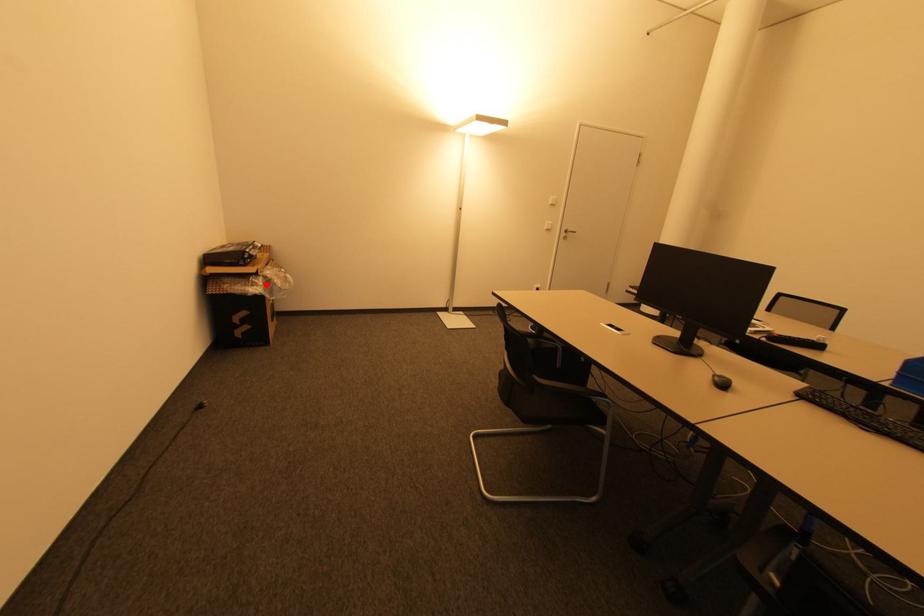
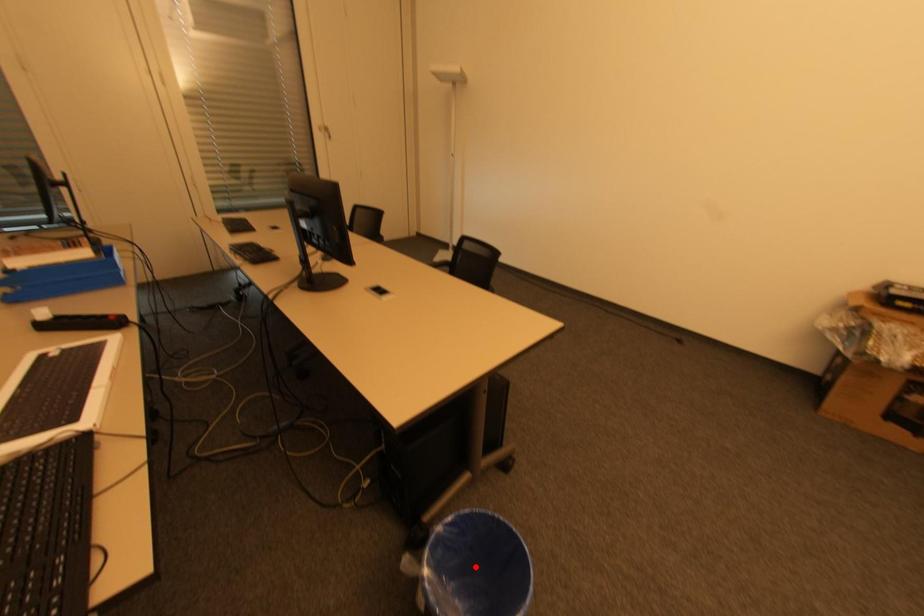
From the picture: I am providing you with two images of the same scene from different viewpoints. A red point is marked on the first image and another point is marked on the second image. Are the points marked in image1 and image2 representing the same 3D position?

No